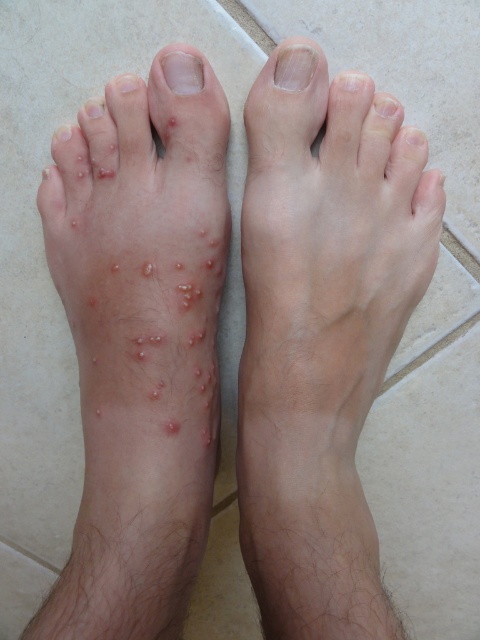
Can you confirm if smooth skin leg at center is shorter than dry skin at upper right?

No, smooth skin leg at center is not shorter than dry skin at upper right.

Does smooth skin leg at center have a larger size compared to dry skin at upper right?

Indeed, smooth skin leg at center has a larger size compared to dry skin at upper right.

Describe the element at coordinates (322, 340) in the screenshot. Image resolution: width=480 pixels, height=640 pixels. I see `smooth skin leg at center` at that location.

At what (x,y) coordinates should I click in order to perform the action: click on smooth skin leg at center. Please return your answer as a coordinate pair (x, y). The image size is (480, 640). Looking at the image, I should click on (322, 340).

Looking at this image, who is more forward, (157,627) or (180,60)?

Point (157,627) is in front.

From the picture: Can you confirm if dry skin patches at left is bigger than matte skin toe at center?

Yes, dry skin patches at left is bigger than matte skin toe at center.

Between point (130, 618) and point (168, 83), which one is positioned in front?

Point (130, 618)

Locate an element on the screen. This screenshot has height=640, width=480. dry skin patches at left is located at coordinates (139, 348).

Which of these two, matte skin toe at center or dry skin at upper right, stands taller?

Standing taller between the two is dry skin at upper right.

Is point (184, 60) positioned behind point (420, 198)?

No, (184, 60) is closer to viewer.

At what (x,y) coordinates should I click in order to perform the action: click on matte skin toe at center. Please return your answer as a coordinate pair (x, y). Looking at the image, I should click on (182, 72).